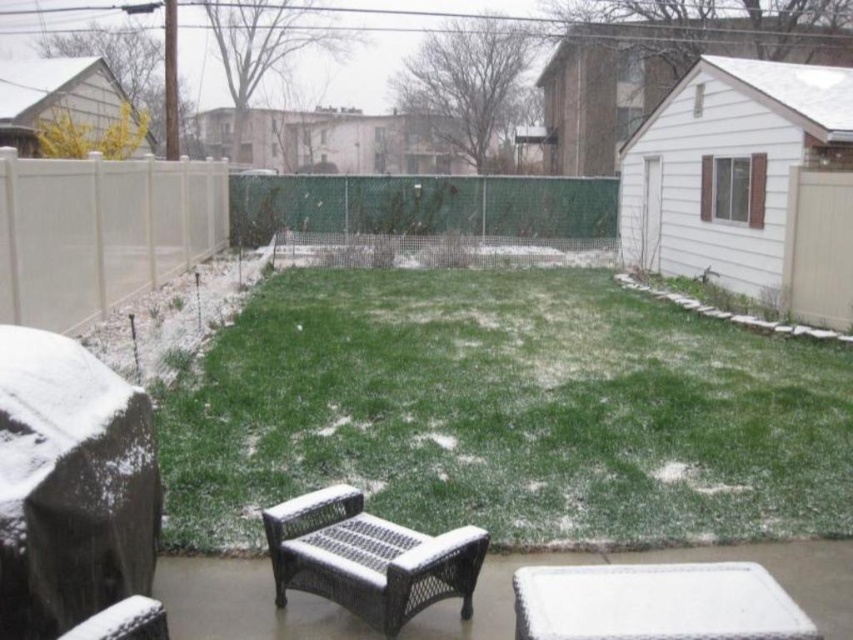
Question: Is green grass at center thinner than woven brown chair at lower center?

Choices:
 (A) yes
 (B) no

Answer: (B)

Question: Estimate the real-world distances between objects in this image. Which object is closer to the woven brown chair at lower center?

Choices:
 (A) green grass at center
 (B) white vinyl fence at upper left

Answer: (A)

Question: Among these points, which one is farthest from the camera?

Choices:
 (A) (407, 212)
 (B) (837, 499)
 (C) (451, 580)

Answer: (A)

Question: Is white vinyl fence at upper left wider than woven brown chair at lower center?

Choices:
 (A) no
 (B) yes

Answer: (B)

Question: Which point is farther to the camera?

Choices:
 (A) (500, 317)
 (B) (328, 532)

Answer: (A)

Question: Is green grass at center further to the viewer compared to white vinyl fence at upper left?

Choices:
 (A) no
 (B) yes

Answer: (A)